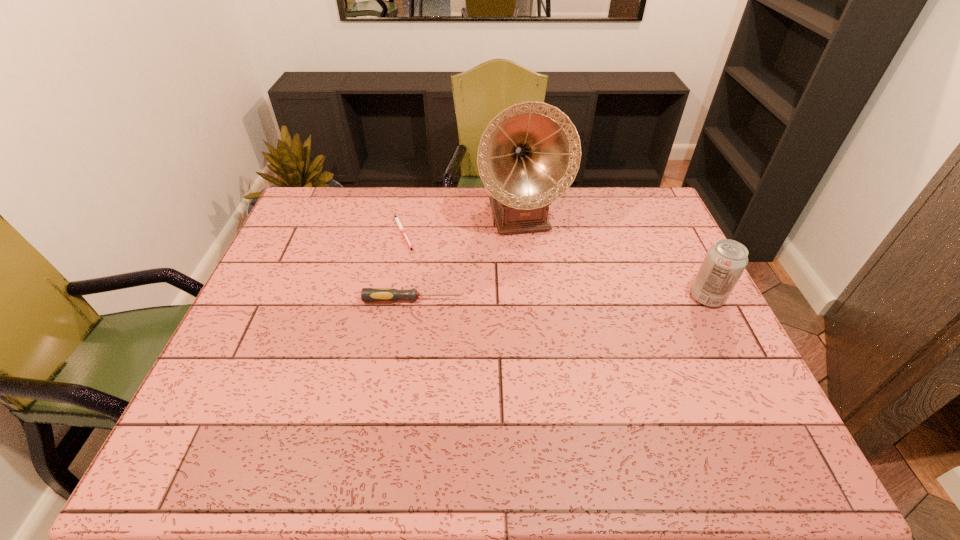
This screenshot has height=540, width=960. I want to click on vacant space on the desktop that is between the screwdriver and the rightmost object and is positioned on the horn of the third object from left to right, so click(550, 299).

Find the location of a particular element. This screenshot has width=960, height=540. vacant space on the desktop that is between the screwdriver and the rightmost object and is positioned on the clicker of the pen is located at coordinates (539, 299).